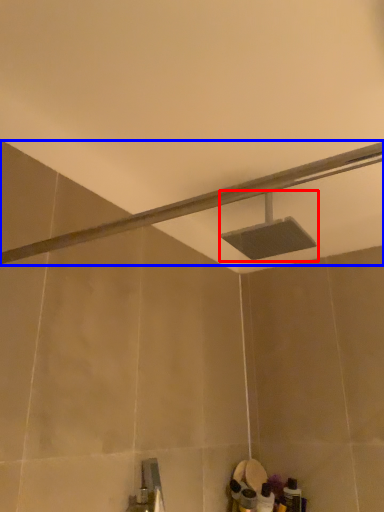
Question: Which object is closer to the camera taking this photo, shower (highlighted by a red box) or shower (highlighted by a blue box)?

Choices:
 (A) shower
 (B) shower

Answer: (B)